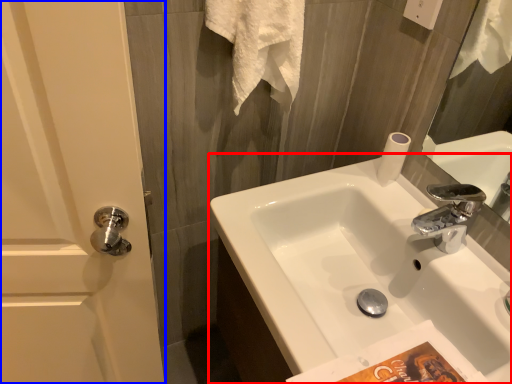
Question: Among these objects, which one is farthest to the camera, sink (highlighted by a red box) or screen door (highlighted by a blue box)?

Choices:
 (A) sink
 (B) screen door

Answer: (A)